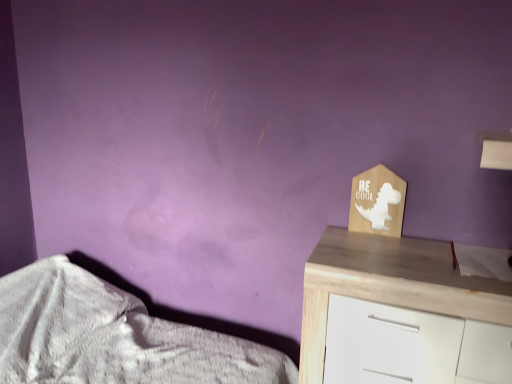
Where is `white textured fabric at lower left`? This screenshot has width=512, height=384. white textured fabric at lower left is located at coordinates (113, 337).

The height and width of the screenshot is (384, 512). What do you see at coordinates (113, 337) in the screenshot?
I see `white textured fabric at lower left` at bounding box center [113, 337].

I want to click on wooden chest of drawers at right, so click(389, 285).

Describe the element at coordinates (389, 285) in the screenshot. I see `wooden chest of drawers at right` at that location.

At what (x,y) coordinates should I click in order to perform the action: click on white textured fabric at lower left. Please return your answer as a coordinate pair (x, y). Looking at the image, I should click on (113, 337).

From the picture: Considering the relative positions of wooden chest of drawers at right and white textured fabric at lower left in the image provided, is wooden chest of drawers at right to the right of white textured fabric at lower left from the viewer's perspective?

Yes, wooden chest of drawers at right is to the right of white textured fabric at lower left.

Between wooden chest of drawers at right and white textured fabric at lower left, which one is positioned in front?

Positioned in front is white textured fabric at lower left.

Between point (487, 321) and point (170, 367), which one is positioned behind?

Point (170, 367)

From the image's perspective, relative to white textured fabric at lower left, is wooden chest of drawers at right above or below?

Based on their image positions, wooden chest of drawers at right is located above white textured fabric at lower left.

From a real-world perspective, does wooden chest of drawers at right sit lower than white textured fabric at lower left?

No, from a real-world perspective, wooden chest of drawers at right is not beneath white textured fabric at lower left.

Which of these two, wooden chest of drawers at right or white textured fabric at lower left, is thinner?

With smaller width is wooden chest of drawers at right.

Is wooden chest of drawers at right taller than white textured fabric at lower left?

Correct, wooden chest of drawers at right is much taller as white textured fabric at lower left.

From the picture: Can you confirm if wooden chest of drawers at right is smaller than white textured fabric at lower left?

Yes, wooden chest of drawers at right is smaller than white textured fabric at lower left.

Is wooden chest of drawers at right inside or outside of white textured fabric at lower left?

wooden chest of drawers at right exists outside the volume of white textured fabric at lower left.

Are wooden chest of drawers at right and white textured fabric at lower left far apart?

No, there isn't a large distance between wooden chest of drawers at right and white textured fabric at lower left.

Is wooden chest of drawers at right facing away from white textured fabric at lower left?

wooden chest of drawers at right is not turned away from white textured fabric at lower left.

What's the angular difference between wooden chest of drawers at right and white textured fabric at lower left's facing directions?

They differ by 0.0285 degrees in their facing directions.

Find the location of a particular element. the chest of drawers that is above the white textured fabric at lower left (from a real-world perspective) is located at coordinates (389, 285).

Can you confirm if white textured fabric at lower left is positioned to the left of wooden chest of drawers at right?

Indeed, white textured fabric at lower left is positioned on the left side of wooden chest of drawers at right.

Who is more distant, white textured fabric at lower left or wooden chest of drawers at right?

Positioned behind is wooden chest of drawers at right.

Does point (37, 321) come in front of point (306, 369)?

No, it is not.

From the image's perspective, is white textured fabric at lower left beneath wooden chest of drawers at right?

Yes, from the image's perspective, white textured fabric at lower left is beneath wooden chest of drawers at right.

From a real-world perspective, who is located higher, white textured fabric at lower left or wooden chest of drawers at right?

wooden chest of drawers at right.

Does white textured fabric at lower left have a greater width compared to wooden chest of drawers at right?

Yes, white textured fabric at lower left is wider than wooden chest of drawers at right.

Considering the relative sizes of white textured fabric at lower left and wooden chest of drawers at right in the image provided, is white textured fabric at lower left taller than wooden chest of drawers at right?

No.

Which of these two, white textured fabric at lower left or wooden chest of drawers at right, is smaller?

wooden chest of drawers at right.

Would you say wooden chest of drawers at right is part of white textured fabric at lower left's contents?

No.

Would you consider white textured fabric at lower left to be distant from wooden chest of drawers at right?

They are positioned close to each other.

Could you tell me if white textured fabric at lower left is facing wooden chest of drawers at right?

No, white textured fabric at lower left does not turn towards wooden chest of drawers at right.

Measure the distance from white textured fabric at lower left to wooden chest of drawers at right.

The distance of white textured fabric at lower left from wooden chest of drawers at right is 27.18 inches.

The height and width of the screenshot is (384, 512). Find the location of `bed below the wooden chest of drawers at right (from a real-world perspective)`. bed below the wooden chest of drawers at right (from a real-world perspective) is located at coordinates (113, 337).

Locate an element on the screen. This screenshot has width=512, height=384. bed on the left side of wooden chest of drawers at right is located at coordinates (113, 337).

You are a GUI agent. You are given a task and a screenshot of the screen. Output one action in this format:
    pyautogui.click(x=<x>, y=<y>)
    Task: Click on the chest of drawers located on the right of white textured fabric at lower left
    The height and width of the screenshot is (384, 512).
    Given the screenshot: What is the action you would take?
    pyautogui.click(x=389, y=285)